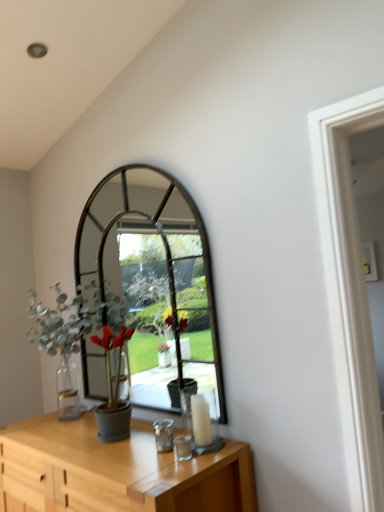
Question: From a real-world perspective, is green matte plant at left above or below white glass candle at center?

Choices:
 (A) below
 (B) above

Answer: (B)

Question: In the image, is green matte plant at left positioned in front of or behind white glass candle at center?

Choices:
 (A) front
 (B) behind

Answer: (B)

Question: Estimate the real-world distances between objects in this image. Which object is closer to the light wood table at lower center?

Choices:
 (A) green matte plant at left
 (B) white glass candle at center

Answer: (B)

Question: Based on their relative distances, which object is nearer to the green matte plant at left?

Choices:
 (A) light wood table at lower center
 (B) white glass candle at center

Answer: (A)